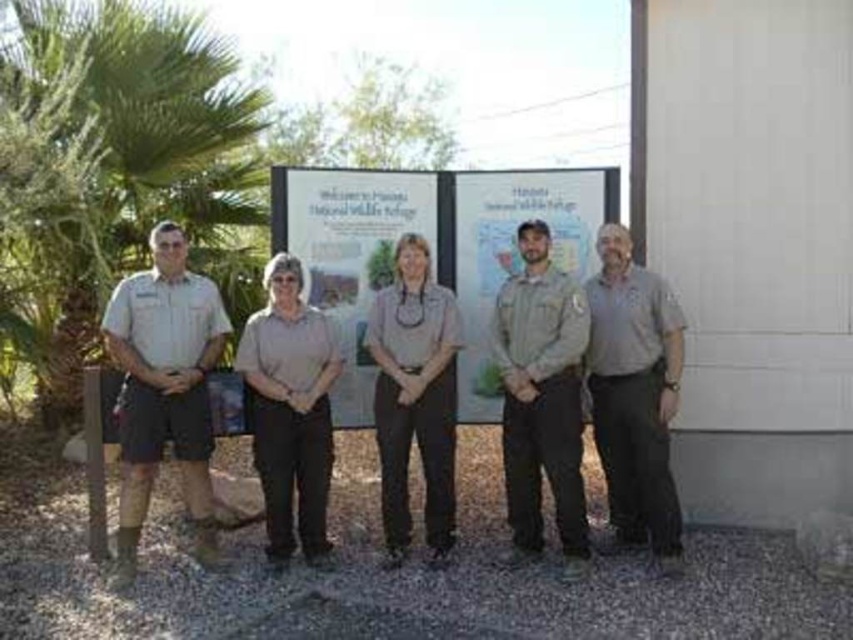
Question: Which point appears closest to the camera in this image?

Choices:
 (A) (520, 438)
 (B) (310, 545)
 (C) (357, 360)

Answer: (B)

Question: Can you confirm if gray cotton shirt at right is bigger than matte brown sign at center?

Choices:
 (A) no
 (B) yes

Answer: (A)

Question: Which of the following is the farthest from the observer?

Choices:
 (A) gray cotton shirt at right
 (B) tan uniform at left
 (C) gray uniform at center

Answer: (C)

Question: Is khaki uniform pants at center wider than brown uniform at center?

Choices:
 (A) yes
 (B) no

Answer: (B)

Question: Which of the following is the farthest from the observer?

Choices:
 (A) (589, 365)
 (B) (306, 173)
 (C) (277, 362)
 (D) (572, 259)

Answer: (D)

Question: Is white paperboard sign at center positioned at the back of brown uniform at center?

Choices:
 (A) no
 (B) yes

Answer: (B)